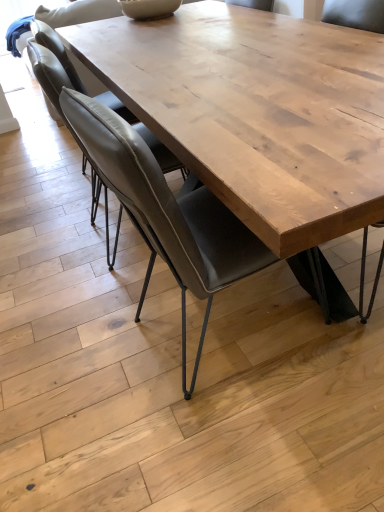
What do you see at coordinates (167, 213) in the screenshot?
I see `leather-like gray chair at center, which ranks as the first chair in front-to-back order` at bounding box center [167, 213].

This screenshot has width=384, height=512. Identify the location of leather-like gray chair at center, the 2th chair from the back. (167, 213).

What do you see at coordinates (52, 69) in the screenshot? The height and width of the screenshot is (512, 384). I see `leather at left, the 2th chair when ordered from front to back` at bounding box center [52, 69].

This screenshot has width=384, height=512. What are the coordinates of `leather at left, placed as the first chair when sorted from back to front` in the screenshot? It's located at (52, 69).

Based on the photo, measure the distance between point (56, 92) and camera.

1.28 meters.

Where is `leather-like gray chair at center, which ranks as the first chair in front-to-back order`? The height and width of the screenshot is (512, 384). leather-like gray chair at center, which ranks as the first chair in front-to-back order is located at coordinates (167, 213).

From the picture: Considering the relative positions of leather-like gray chair at center, which ranks as the first chair in front-to-back order, and leather at left, the 2th chair when ordered from front to back, in the image provided, is leather-like gray chair at center, which ranks as the first chair in front-to-back order, to the right of leather at left, the 2th chair when ordered from front to back, from the viewer's perspective?

Indeed, leather-like gray chair at center, which ranks as the first chair in front-to-back order, is positioned on the right side of leather at left, the 2th chair when ordered from front to back.

Does leather-like gray chair at center, which ranks as the first chair in front-to-back order, come behind leather at left, the 2th chair when ordered from front to back?

No, leather-like gray chair at center, which ranks as the first chair in front-to-back order, is closer to the camera.

Which point is more distant from viewer, (162, 238) or (168, 170)?

The point (168, 170) is farther.

From the image's perspective, is leather-like gray chair at center, which ranks as the first chair in front-to-back order, beneath leather at left, placed as the first chair when sorted from back to front?

Yes.

From a real-world perspective, which object stands above the other?

From a 3D spatial view, leather at left, the 2th chair when ordered from front to back, is above.

Between leather-like gray chair at center, which ranks as the first chair in front-to-back order, and leather at left, placed as the first chair when sorted from back to front, which one has smaller width?

Thinner between the two is leather at left, placed as the first chair when sorted from back to front.

Between leather-like gray chair at center, which ranks as the first chair in front-to-back order, and leather at left, the 2th chair when ordered from front to back, which one has less height?

With less height is leather at left, the 2th chair when ordered from front to back.

Is leather-like gray chair at center, the 2th chair from the back, smaller than leather at left, the 2th chair when ordered from front to back?

No.

Is leather-like gray chair at center, which ranks as the first chair in front-to-back order, surrounding leather at left, placed as the first chair when sorted from back to front?

Definitely not — leather at left, placed as the first chair when sorted from back to front, is not inside leather-like gray chair at center, which ranks as the first chair in front-to-back order.

Is there a large distance between leather-like gray chair at center, the 2th chair from the back, and leather at left, the 2th chair when ordered from front to back?

They are positioned close to each other.

Does leather-like gray chair at center, which ranks as the first chair in front-to-back order, turn towards leather at left, the 2th chair when ordered from front to back?

No, leather-like gray chair at center, which ranks as the first chair in front-to-back order, does not turn towards leather at left, the 2th chair when ordered from front to back.

How far apart are leather-like gray chair at center, the 2th chair from the back, and leather at left, placed as the first chair when sorted from back to front?

They are 11.56 inches apart.

The width and height of the screenshot is (384, 512). I want to click on chair lying in front of the leather at left, the 2th chair when ordered from front to back, so click(167, 213).

Considering the relative positions of leather at left, the 2th chair when ordered from front to back, and leather-like gray chair at center, the 2th chair from the back, in the image provided, is leather at left, the 2th chair when ordered from front to back, to the left or to the right of leather-like gray chair at center, the 2th chair from the back,?

From the image, it's evident that leather at left, the 2th chair when ordered from front to back, is to the left of leather-like gray chair at center, the 2th chair from the back.

Which object is further away from the camera, leather at left, placed as the first chair when sorted from back to front, or leather-like gray chair at center, which ranks as the first chair in front-to-back order?

leather at left, placed as the first chair when sorted from back to front, is further from the camera.

Is point (118, 233) farther from viewer compared to point (211, 270)?

Yes.

From the image's perspective, is leather at left, the 2th chair when ordered from front to back, under leather-like gray chair at center, which ranks as the first chair in front-to-back order?

No, from the image's perspective, leather at left, the 2th chair when ordered from front to back, is not beneath leather-like gray chair at center, which ranks as the first chair in front-to-back order.

From a real-world perspective, which object stands above the other?

leather at left, the 2th chair when ordered from front to back, is physically above.

Which of these two, leather at left, the 2th chair when ordered from front to back, or leather-like gray chair at center, which ranks as the first chair in front-to-back order, is thinner?

leather at left, the 2th chair when ordered from front to back, is thinner.

Who is shorter, leather at left, placed as the first chair when sorted from back to front, or leather-like gray chair at center, the 2th chair from the back?

leather at left, placed as the first chair when sorted from back to front, is shorter.

In terms of size, does leather at left, placed as the first chair when sorted from back to front, appear bigger or smaller than leather-like gray chair at center, which ranks as the first chair in front-to-back order?

Considering their sizes, leather at left, placed as the first chair when sorted from back to front, takes up less space than leather-like gray chair at center, which ranks as the first chair in front-to-back order.

Do you think leather at left, the 2th chair when ordered from front to back, is within leather-like gray chair at center, which ranks as the first chair in front-to-back order, or outside of it?

leather at left, the 2th chair when ordered from front to back, cannot be found inside leather-like gray chair at center, which ranks as the first chair in front-to-back order.

Is there a large distance between leather at left, placed as the first chair when sorted from back to front, and leather-like gray chair at center, the 2th chair from the back?

They are positioned close to each other.

Is leather at left, placed as the first chair when sorted from back to front, aimed at leather-like gray chair at center, the 2th chair from the back?

No.

Can you tell me how much leather at left, placed as the first chair when sorted from back to front, and leather-like gray chair at center, which ranks as the first chair in front-to-back order, differ in facing direction?

5.51 degrees separate the facing orientations of leather at left, placed as the first chair when sorted from back to front, and leather-like gray chair at center, which ranks as the first chair in front-to-back order.

You are a GUI agent. You are given a task and a screenshot of the screen. Output one action in this format:
    pyautogui.click(x=<x>, y=<y>)
    Task: Click on the chair on the right of leather at left, the 2th chair when ordered from front to back
    This screenshot has height=512, width=384.
    Given the screenshot: What is the action you would take?
    pyautogui.click(x=167, y=213)

Locate an element on the screen. The image size is (384, 512). chair that appears in front of the leather at left, the 2th chair when ordered from front to back is located at coordinates (167, 213).

Where is `chair below the leather at left, the 2th chair when ordered from front to back (from the image's perspective)`? The height and width of the screenshot is (512, 384). chair below the leather at left, the 2th chair when ordered from front to back (from the image's perspective) is located at coordinates (167, 213).